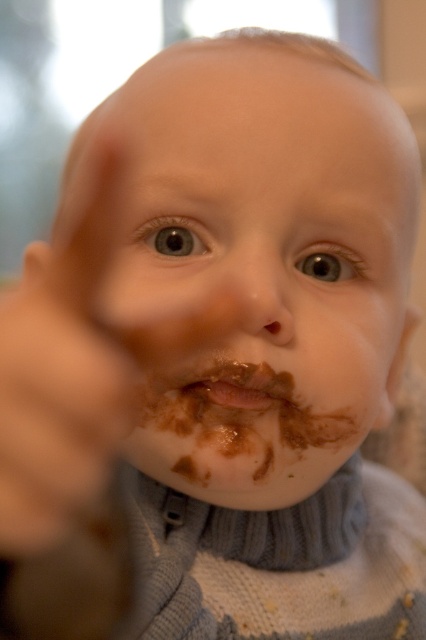
Is brown matte finger at center thinner than chocolate matte lips at center?

Yes.

Does brown matte finger at center appear over chocolate matte lips at center?

Yes, brown matte finger at center is above chocolate matte lips at center.

At what (x,y) coordinates should I click in order to perform the action: click on brown matte finger at center. Please return your answer as a coordinate pair (x, y). Looking at the image, I should click on (54, 417).

Is point (252, 493) closer to viewer compared to point (36, 304)?

No, (252, 493) is behind (36, 304).

Is the position of chocolate matte face at center more distant than that of brown matte finger at center?

Yes, chocolate matte face at center is further from the viewer.

Where is `chocolate matte face at center`? This screenshot has height=640, width=426. chocolate matte face at center is located at coordinates (264, 253).

Between chocolate matte face at center and chocolate matte lips at center, which one appears on the right side from the viewer's perspective?

chocolate matte lips at center is more to the right.

Can you confirm if chocolate matte face at center is shorter than chocolate matte lips at center?

In fact, chocolate matte face at center may be taller than chocolate matte lips at center.

I want to click on chocolate matte face at center, so click(x=264, y=253).